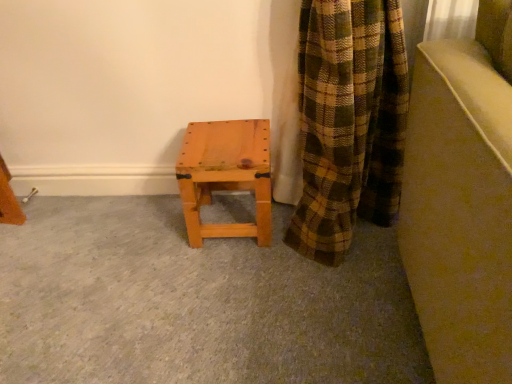
Identify the location of vacant space underneath natural wood stool at center (from a real-world perspective). (227, 207).